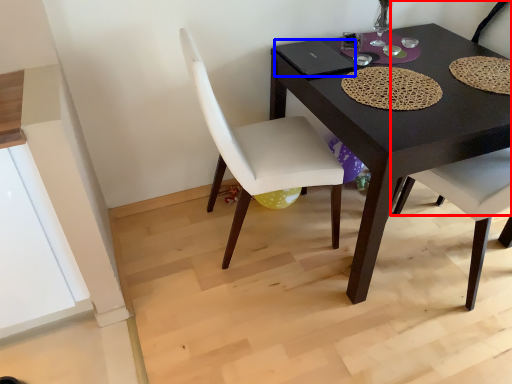
Question: Which object is closer to the camera taking this photo, chair (highlighted by a red box) or laptop (highlighted by a blue box)?

Choices:
 (A) chair
 (B) laptop

Answer: (A)